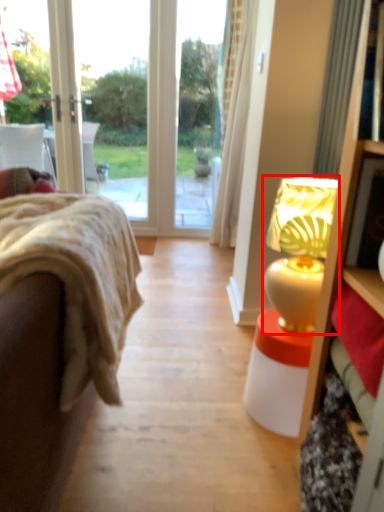
Question: From the image, what is the correct spatial relationship of table lamp (annotated by the red box) in relation to studio couch?

Choices:
 (A) right
 (B) left

Answer: (A)